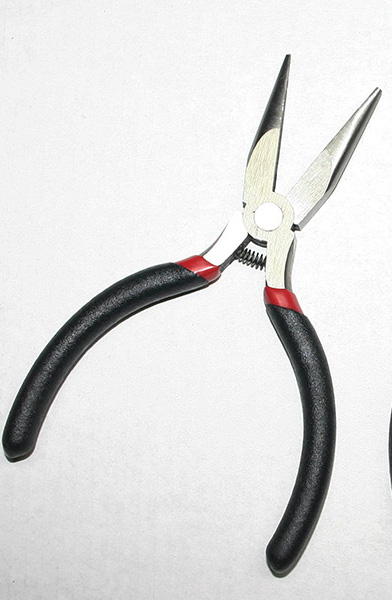
Where is `handle`? This screenshot has height=600, width=392. handle is located at coordinates (69, 348), (317, 462).